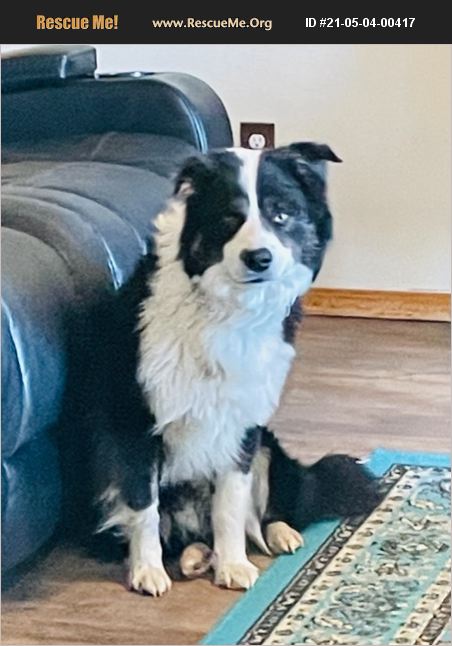
The image size is (452, 646). I want to click on baseboard, so click(x=383, y=304).